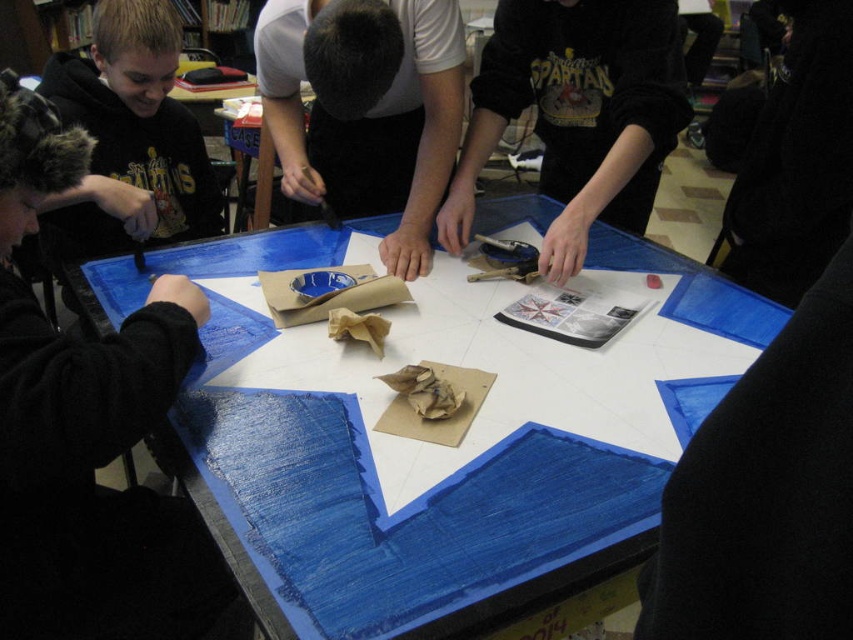
You are organizing a craft event and need to place the black cotton sweatshirt at upper center and the white matte paper at center on a shelf. If the shelf has limited space, which item should you place first to ensure both fit?

Since the black cotton sweatshirt at upper center is bigger than the white matte paper at center, you should place the black cotton sweatshirt at upper center first to ensure both items fit on the shelf.

You are organizing a craft event and need to know if the blue painted wood table at center can accommodate a large craft project. Considering the size of the black cotton sweatshirt at upper center, which is present on the table, can the table hold the project?

The blue painted wood table at center has a larger size compared to the black cotton sweatshirt at upper center, so it can accommodate a large craft project as the table is bigger than the sweatshirt.

You are an observer looking at the scene. Which clothing item is closer to you, the black cotton sweatshirt at upper center or the matte black hoodie at left?

The matte black hoodie at left is behind the black cotton sweatshirt at upper center, so the black cotton sweatshirt at upper center is closer to you.